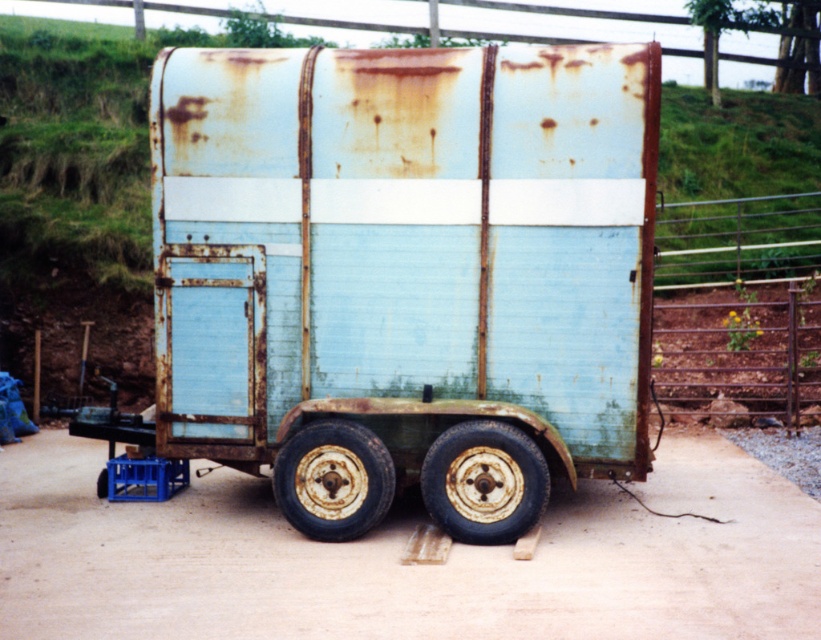
You are standing near the rusty metal trailer at center and the brown dirt track at center. If you were to place a 1.2 meter tall box on the ground, which object would the box be taller than?

The box would be taller than the brown dirt track at center because the rusty metal trailer at center has a greater height compared to the brown dirt track at center, but the box is 1.2 meters tall which is taller than the trailer and the track.

You are a delivery driver who needs to drive a truck through the area shown in the image. The truck requires a path wider than the rusty metal trailer at center. Can you determine if the brown dirt track at center is wide enough for your truck?

The rusty metal trailer at center has a larger size compared to brown dirt track at center, so the dirt track is narrower than the trailer. Since the truck needs a path wider than the trailer, the brown dirt track at center is not wide enough for the truck.